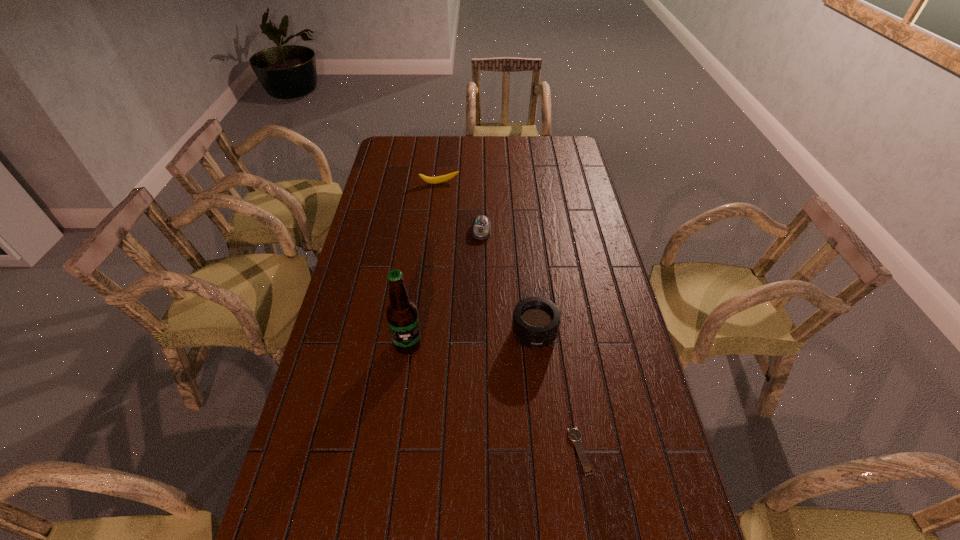
You are a GUI agent. You are given a task and a screenshot of the screen. Output one action in this format:
    pyautogui.click(x=<x>, y=<y>)
    Task: Click on the free space between the banana and the computer mouse
    
    Given the screenshot: What is the action you would take?
    pyautogui.click(x=460, y=207)

I want to click on empty space between the tallest object and the fourth nearest object, so click(444, 287).

Where is `unoccupied area between the banana and the third object from left to right`? The width and height of the screenshot is (960, 540). unoccupied area between the banana and the third object from left to right is located at coordinates (460, 207).

Locate an element on the screen. The image size is (960, 540). free space between the second tallest object and the shortest object is located at coordinates (557, 392).

Locate which object is the second closest to the watch. Please provide its 2D coordinates. Your answer should be formatted as a tuple, i.e. [(x, y)], where the tuple contains the x and y coordinates of a point satisfying the conditions above.

[(402, 316)]

Select which object appears as the fourth closest to the shortest object. Please provide its 2D coordinates. Your answer should be formatted as a tuple, i.e. [(x, y)], where the tuple contains the x and y coordinates of a point satisfying the conditions above.

[(439, 179)]

In order to click on vacant space that satisfies the following two spatial constraints: 1. on the front side of the banana; 2. on the left side of the watch in this screenshot , I will do `click(409, 451)`.